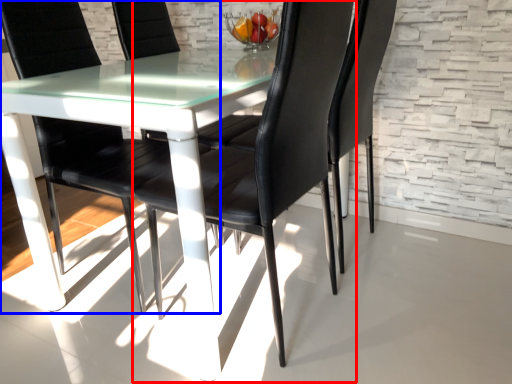
Question: Among these objects, which one is farthest to the camera, chair (highlighted by a red box) or chair (highlighted by a blue box)?

Choices:
 (A) chair
 (B) chair

Answer: (B)